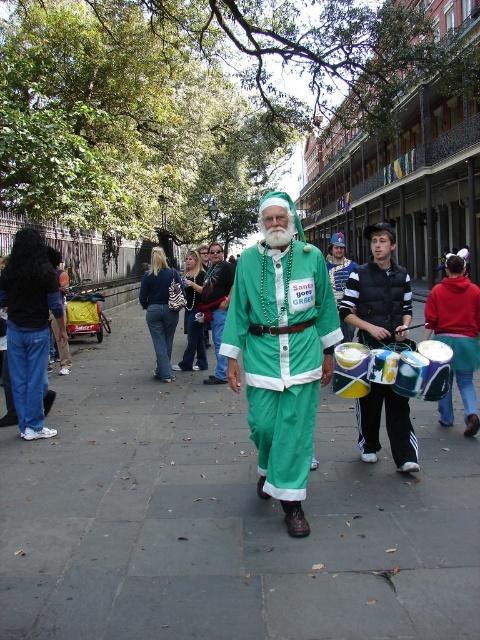
Measure the distance between green satin santa at center and camera.

3.91 meters

Can you confirm if green satin santa at center is positioned below green matte santa suit at center?

Indeed, green satin santa at center is positioned under green matte santa suit at center.

Locate an element on the screen. green satin santa at center is located at coordinates pos(282,349).

Find the location of a particular element. The width and height of the screenshot is (480, 640). green satin santa at center is located at coordinates (282, 349).

Between black and white striped vest at center and green matte santa suit at center, which one appears on the left side from the viewer's perspective?

green matte santa suit at center is more to the left.

Is black and white striped vest at center to the left of green matte santa suit at center from the viewer's perspective?

In fact, black and white striped vest at center is to the right of green matte santa suit at center.

Identify the location of black and white striped vest at center. (379, 292).

Locate an element on the screen. black and white striped vest at center is located at coordinates (379, 292).

Between green fabric pants at center and green matte santa suit at center, which one appears on the left side from the viewer's perspective?

green matte santa suit at center is more to the left.

Which is above, green fabric pants at center or green matte santa suit at center?

green matte santa suit at center is above.

Who is more distant from viewer, (x=402, y=520) or (x=210, y=376)?

Positioned behind is point (x=210, y=376).

The width and height of the screenshot is (480, 640). Identify the location of green fabric pants at center. (225, 518).